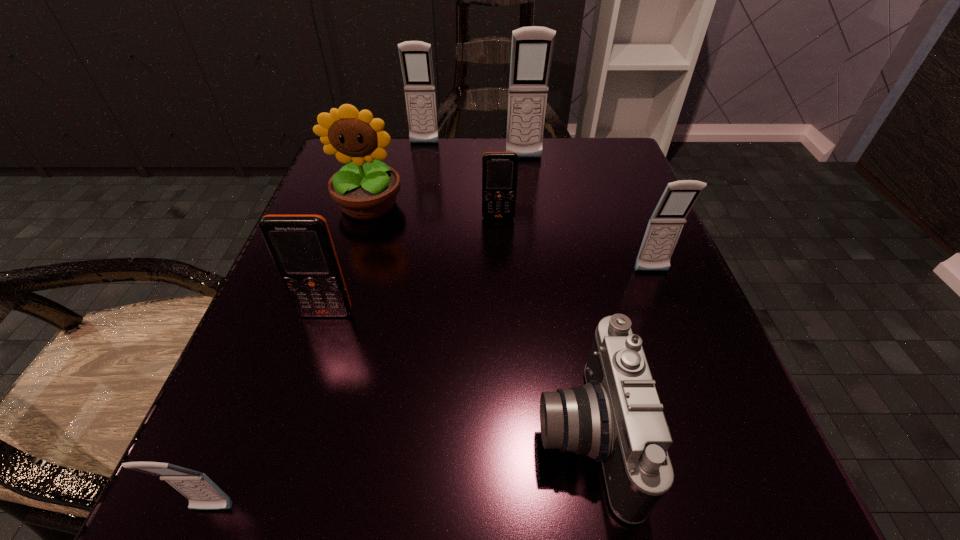
In order to click on free space between the second farthest object and the camera in this screenshot , I will do `click(554, 296)`.

Find the location of `free space that is in between the rightmost gray cellular telephone and the sunflower`. free space that is in between the rightmost gray cellular telephone and the sunflower is located at coordinates (510, 238).

Locate an element on the screen. vacant space in between the sunflower and the black camera is located at coordinates (476, 320).

This screenshot has width=960, height=540. I want to click on vacant area between the tallest cellular telephone and the fifth farthest cellular telephone, so click(x=425, y=236).

The image size is (960, 540). I want to click on vacant point located between the seventh nearest object and the farthest cellular telephone, so click(474, 151).

This screenshot has width=960, height=540. Find the location of `empty location between the fourth cellular telephone from right to left and the second farthest object`. empty location between the fourth cellular telephone from right to left and the second farthest object is located at coordinates (474, 151).

This screenshot has height=540, width=960. Find the location of `vacant area between the farthest cellular telephone and the leftmost gray cellular telephone`. vacant area between the farthest cellular telephone and the leftmost gray cellular telephone is located at coordinates (319, 327).

At what (x,y) coordinates should I click in order to perform the action: click on free space between the second farthest gray cellular telephone and the third nearest cellular telephone. Please return your answer as a coordinate pair (x, y). Looking at the image, I should click on tap(588, 215).

Find the location of a particular element. object that is the seventh closest to the black camera is located at coordinates (415, 56).

The image size is (960, 540). What are the coordinates of `object that is the fifth nearest to the right orange cellular telephone` in the screenshot? It's located at (301, 246).